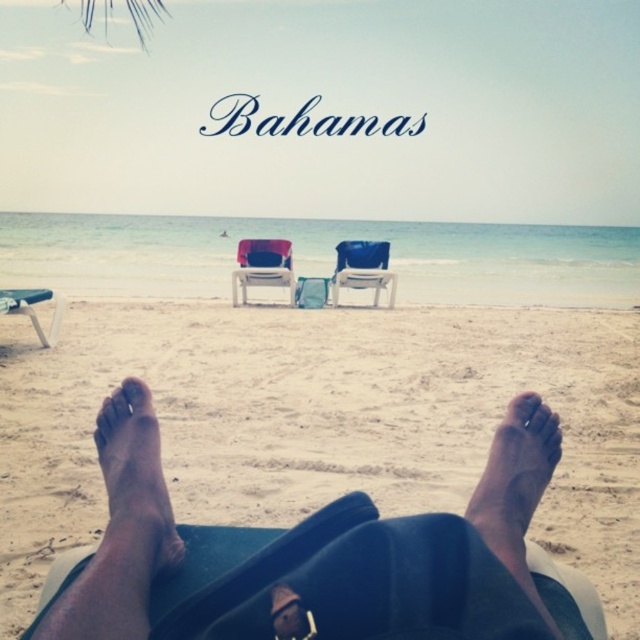
Question: Which point is closer to the camera?

Choices:
 (A) matte black lounge chair at lower left
 (B) matte pink fabric chair at center

Answer: (A)

Question: Does dry skin at lower center come behind matte black lounge chair at lower left?

Choices:
 (A) no
 (B) yes

Answer: (A)

Question: Which object is positioned closest to the matte pink fabric chair at center?

Choices:
 (A) blue plastic chair at center
 (B) brown skin at lower center

Answer: (A)

Question: Which point appears closest to the camera in this image?

Choices:
 (A) (502, 512)
 (B) (394, 289)
 (C) (106, 404)

Answer: (A)

Question: Can you confirm if white sandy beach at lower center is positioned to the left of matte pink fabric chair at center?

Choices:
 (A) no
 (B) yes

Answer: (A)

Question: Can you confirm if blue plastic chair at center is wider than matte black lounge chair at lower left?

Choices:
 (A) yes
 (B) no

Answer: (A)